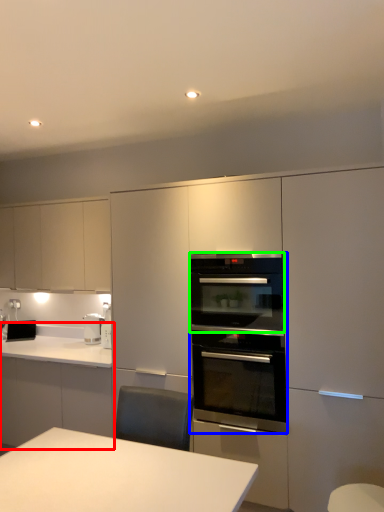
Question: Which is farther away from countertop (highlighted by a red box)? kitchen appliance (highlighted by a blue box) or oven (highlighted by a green box)?

Choices:
 (A) kitchen appliance
 (B) oven

Answer: (B)